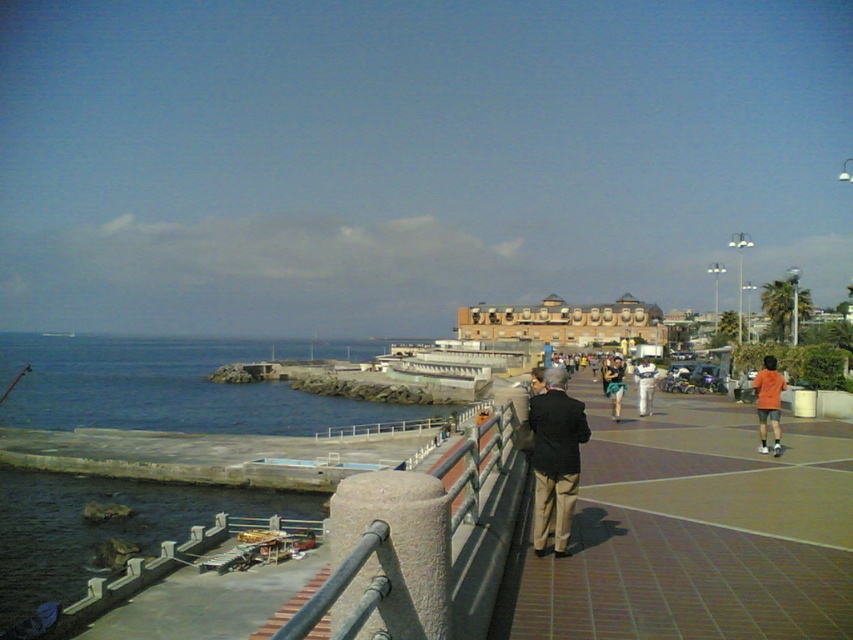
Consider the image. Is brown brick sidewalk at center wider than dark brown suit at center?

Yes, brown brick sidewalk at center is wider than dark brown suit at center.

Who is shorter, brown brick sidewalk at center or dark brown suit at center?

Standing shorter between the two is brown brick sidewalk at center.

Locate an element on the screen. brown brick sidewalk at center is located at coordinates (693, 532).

Does white cotton shirt at center have a lesser height compared to orange t-shirt at center?

Indeed, white cotton shirt at center has a lesser height compared to orange t-shirt at center.

Consider the image. Does white cotton shirt at center have a larger size compared to orange t-shirt at center?

Yes, white cotton shirt at center is bigger than orange t-shirt at center.

The height and width of the screenshot is (640, 853). What do you see at coordinates (643, 385) in the screenshot?
I see `white cotton shirt at center` at bounding box center [643, 385].

At what (x,y) coordinates should I click in order to perform the action: click on white cotton shirt at center. Please return your answer as a coordinate pair (x, y). This screenshot has height=640, width=853. Looking at the image, I should click on (643, 385).

Between blue water at lower left and dark brown suit at center, which one is positioned higher?

dark brown suit at center is above.

Can you confirm if blue water at lower left is positioned below dark brown suit at center?

Yes, blue water at lower left is below dark brown suit at center.

Which is behind, point (149, 339) or point (573, 426)?

Positioned behind is point (149, 339).

Locate an element on the screen. Image resolution: width=853 pixels, height=640 pixels. blue water at lower left is located at coordinates (177, 385).